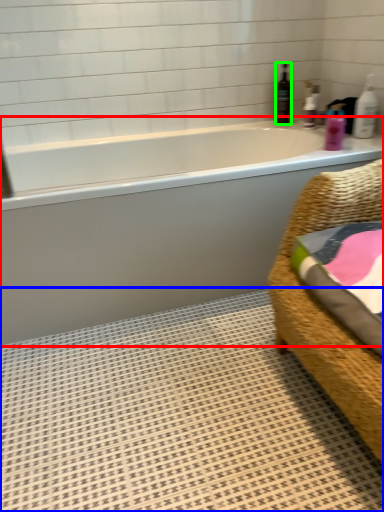
Question: Which object is the farthest from bathtub (highlighted by a red box)? Choose among these: bath mat (highlighted by a blue box) or bottle (highlighted by a green box).

Choices:
 (A) bath mat
 (B) bottle

Answer: (B)